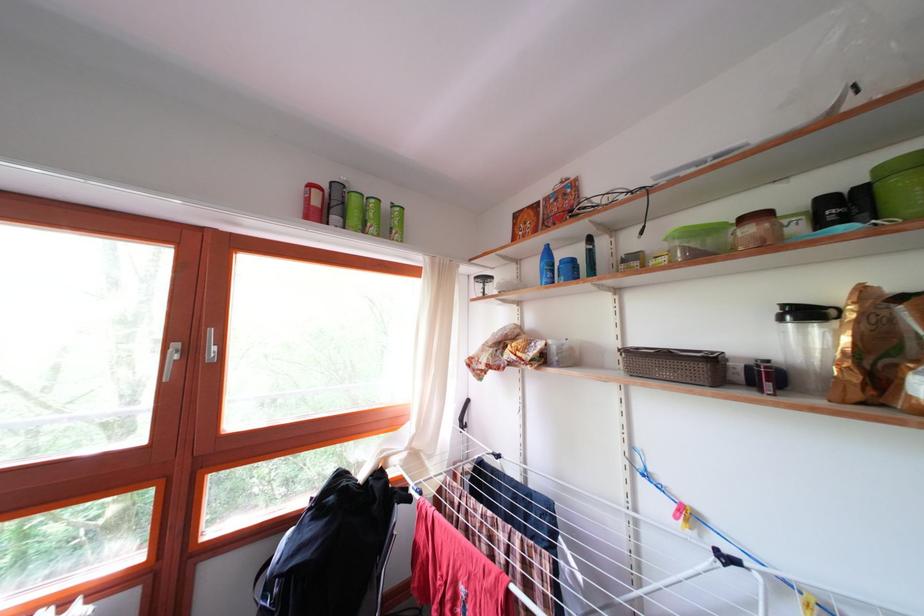
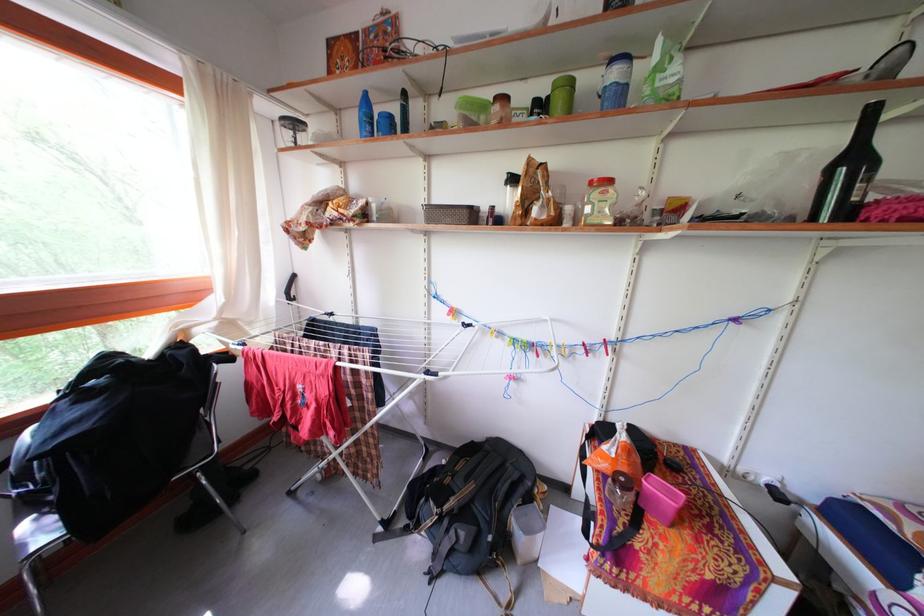
The first image is from the beginning of the video and the second image is from the end. How did the camera likely rotate when shooting the video?

The rotation direction of the camera is right-down.